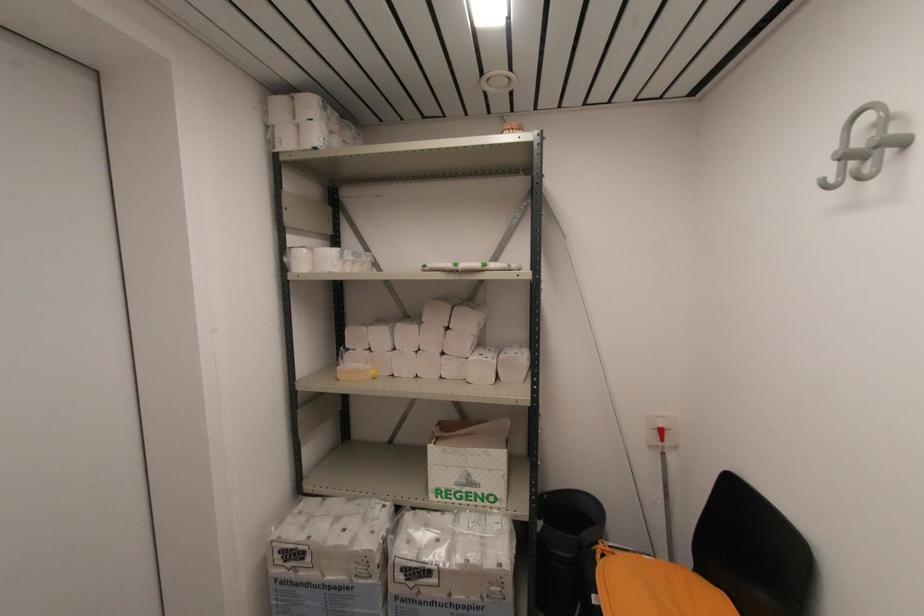
Image resolution: width=924 pixels, height=616 pixels. Find the location of `red t-shaped handle`. red t-shaped handle is located at coordinates (665, 436).